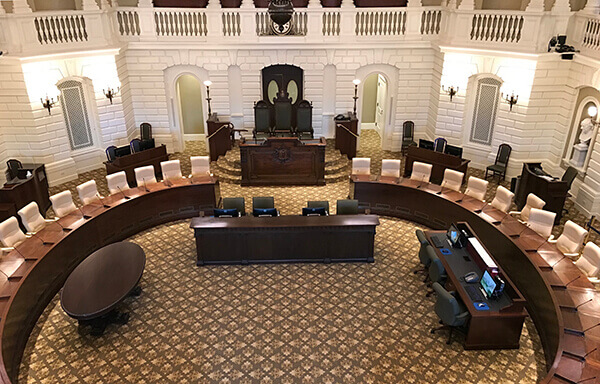
Where is `computers`? computers is located at coordinates (494, 283), (453, 234).